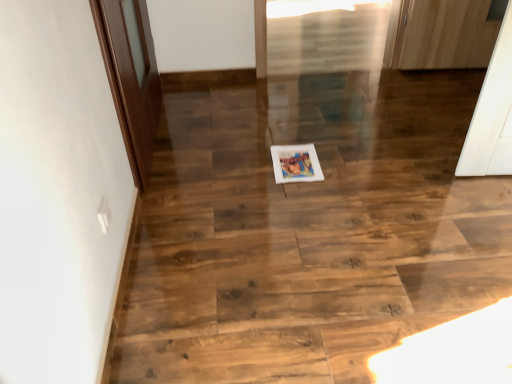
Find the location of a particular element. vacant space in between brown wooden door at left and matte paper postcard at center is located at coordinates (214, 148).